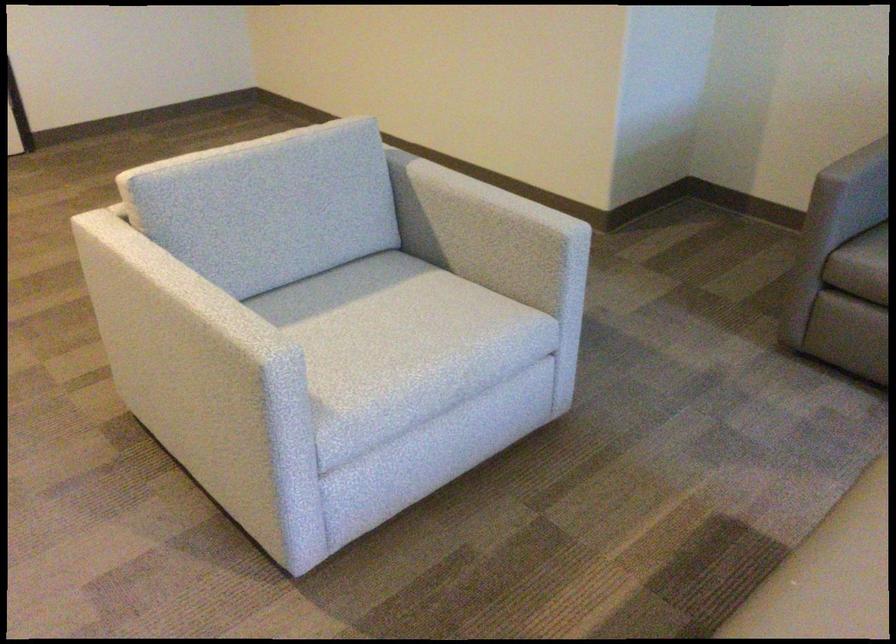
Where would you sit the chair sitting surface? Please return your answer as a coordinate pair (x, y).

(427, 333)